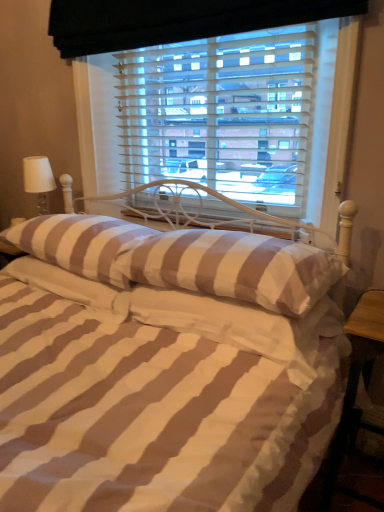
Question: Is brown striped pillow at center, which ranks as the second pillow in left-to-right order, aimed at brown striped pillow at center, which is the 3th pillow from left to right?

Choices:
 (A) yes
 (B) no

Answer: (B)

Question: Considering the relative sizes of brown striped pillow at center, the third pillow when ordered from right to left, and brown striped pillow at center, which is counted as the 2th pillow, starting from the right, in the image provided, is brown striped pillow at center, the third pillow when ordered from right to left, smaller than brown striped pillow at center, which is counted as the 2th pillow, starting from the right,?

Choices:
 (A) yes
 (B) no

Answer: (B)

Question: Would you say brown striped pillow at center, which ranks as the second pillow in left-to-right order, is outside brown striped pillow at center, which is the 3th pillow from left to right?

Choices:
 (A) yes
 (B) no

Answer: (A)

Question: Does brown striped pillow at center, the third pillow when ordered from right to left, come in front of brown striped pillow at center, which is the 3th pillow from left to right?

Choices:
 (A) no
 (B) yes

Answer: (A)

Question: Does brown striped pillow at center, which ranks as the second pillow in left-to-right order, lie behind brown striped pillow at center, which is the 3th pillow from left to right?

Choices:
 (A) no
 (B) yes

Answer: (B)

Question: In the image, is brown striped pillow at center, marked as the 1th pillow in a left-to-right arrangement, positioned in front of or behind wooden table at lower right?

Choices:
 (A) front
 (B) behind

Answer: (B)

Question: Is point (127, 297) positioned closer to the camera than point (352, 414)?

Choices:
 (A) farther
 (B) closer

Answer: (B)

Question: Which is correct: brown striped pillow at center, marked as the 1th pillow in a left-to-right arrangement, is inside wooden table at lower right, or outside of it?

Choices:
 (A) inside
 (B) outside

Answer: (B)

Question: Considering the positions of brown striped pillow at center, the 4th pillow in the right-to-left sequence, and wooden table at lower right in the image, is brown striped pillow at center, the 4th pillow in the right-to-left sequence, bigger or smaller than wooden table at lower right?

Choices:
 (A) big
 (B) small

Answer: (B)

Question: From the image's perspective, is wooden table at lower right positioned above or below brown striped pillow at center, which is counted as the 2th pillow, starting from the right?

Choices:
 (A) above
 (B) below

Answer: (B)

Question: Considering their positions, is wooden table at lower right located in front of or behind brown striped pillow at center, which is counted as the 2th pillow, starting from the right?

Choices:
 (A) front
 (B) behind

Answer: (B)

Question: From a real-world perspective, is wooden table at lower right positioned above or below brown striped pillow at center, which is counted as the 2th pillow, starting from the right?

Choices:
 (A) above
 (B) below

Answer: (B)

Question: In terms of height, does wooden table at lower right look taller or shorter compared to brown striped pillow at center, which is the 3th pillow from left to right?

Choices:
 (A) tall
 (B) short

Answer: (A)

Question: Is point (228, 237) closer or farther from the camera than point (92, 269)?

Choices:
 (A) farther
 (B) closer

Answer: (B)

Question: From the image's perspective, relative to brown striped pillow at center, which ranks as the second pillow in left-to-right order, is brown striped pillow at center, which is counted as the 2th pillow, starting from the right, above or below?

Choices:
 (A) below
 (B) above

Answer: (A)